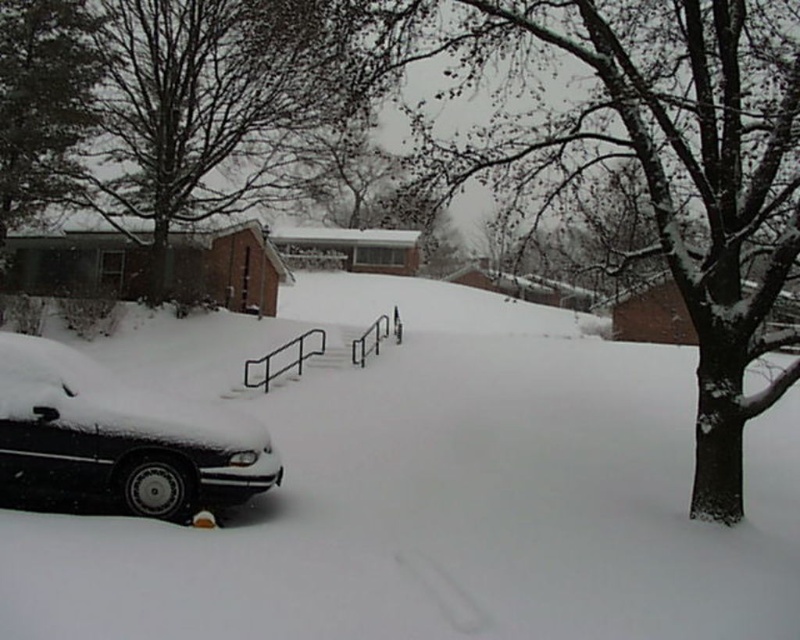
Who is more distant from viewer, (x=285, y=51) or (x=262, y=376)?

Positioned behind is point (x=262, y=376).

Is point (92, 182) behind point (276, 348)?

That is True.

This screenshot has height=640, width=800. I want to click on snow-covered tree at upper center, so click(210, 104).

Is white matte snow at lower left further to camera compared to snow-covered tree at upper center?

No, white matte snow at lower left is closer to the viewer.

Identify the location of white matte snow at lower left. The height and width of the screenshot is (640, 800). (433, 492).

Does white matte snow at lower left come in front of black metal rail at center?

Yes, white matte snow at lower left is in front of black metal rail at center.

Who is shorter, white matte snow at lower left or black metal rail at center?

black metal rail at center

Between point (146, 353) and point (324, 330), which one is positioned behind?

The point (324, 330) is more distant.

Where is `white matte snow at lower left`? The width and height of the screenshot is (800, 640). white matte snow at lower left is located at coordinates (433, 492).